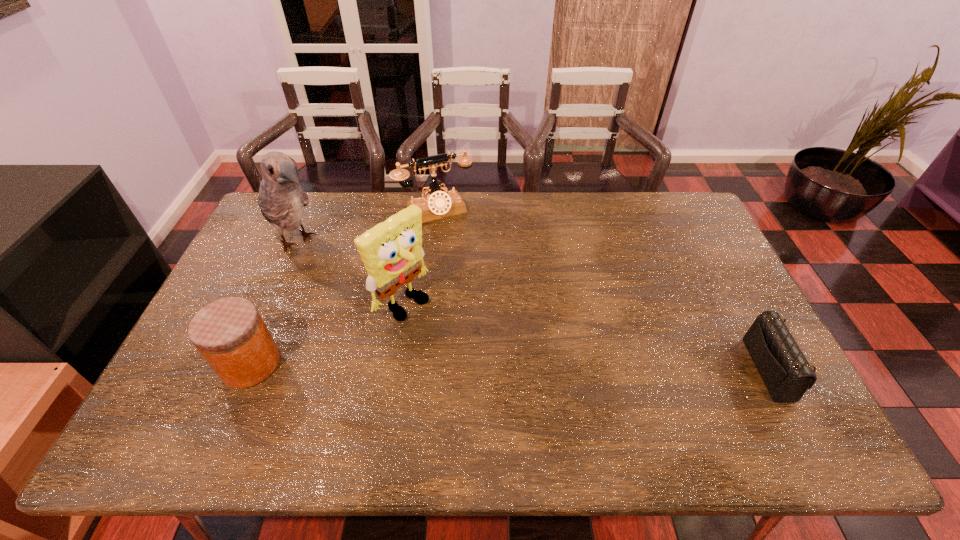
The image size is (960, 540). Find the location of `vacant space on the desktop that is between the fourth tallest object and the clutch bag and is positioned on the face of the third farthest object`. vacant space on the desktop that is between the fourth tallest object and the clutch bag and is positioned on the face of the third farthest object is located at coordinates (488, 366).

Locate an element on the screen. Image resolution: width=960 pixels, height=540 pixels. vacant spot on the desktop that is between the jar and the shortest object and is positioned on the front-facing side of the tallest object is located at coordinates (449, 366).

Locate an element on the screen. free space on the desktop that is between the second shortest object and the clutch bag and is positioned on the dial of the telephone is located at coordinates (518, 367).